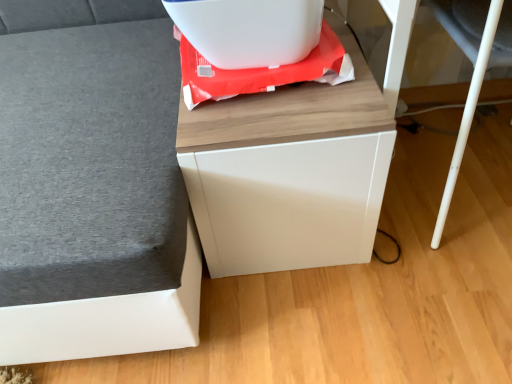
Question: Is the depth of white plastic container at upper center greater than that of white glossy cabinet at center, which appears as the second furniture when viewed from the left?

Choices:
 (A) no
 (B) yes

Answer: (B)

Question: Does white plastic container at upper center have a greater height compared to white glossy cabinet at center, arranged as the first furniture when viewed from the right?

Choices:
 (A) yes
 (B) no

Answer: (B)

Question: From the image's perspective, is white plastic container at upper center under white glossy cabinet at center, arranged as the first furniture when viewed from the right?

Choices:
 (A) yes
 (B) no

Answer: (B)

Question: From the image's perspective, would you say white plastic container at upper center is positioned over white glossy cabinet at center, which appears as the second furniture when viewed from the left?

Choices:
 (A) yes
 (B) no

Answer: (A)

Question: Is white plastic container at upper center oriented towards white glossy cabinet at center, arranged as the first furniture when viewed from the right?

Choices:
 (A) yes
 (B) no

Answer: (B)

Question: Based on their positions, is matte gray sofa at left, the second furniture positioned from the right, located to the left or right of white glossy cabinet at center, arranged as the first furniture when viewed from the right?

Choices:
 (A) left
 (B) right

Answer: (A)

Question: In terms of height, does matte gray sofa at left, the second furniture positioned from the right, look taller or shorter compared to white glossy cabinet at center, which appears as the second furniture when viewed from the left?

Choices:
 (A) short
 (B) tall

Answer: (B)

Question: From a real-world perspective, is matte gray sofa at left, the first furniture positioned from the left, above or below white glossy cabinet at center, which appears as the second furniture when viewed from the left?

Choices:
 (A) above
 (B) below

Answer: (A)

Question: Is point (130, 203) positioned closer to the camera than point (280, 142)?

Choices:
 (A) closer
 (B) farther

Answer: (A)

Question: Is white plastic swivel chair at lower right in front of or behind white glossy cabinet at center, arranged as the first furniture when viewed from the right, in the image?

Choices:
 (A) behind
 (B) front

Answer: (B)

Question: In terms of size, does white plastic swivel chair at lower right appear bigger or smaller than white glossy cabinet at center, which appears as the second furniture when viewed from the left?

Choices:
 (A) big
 (B) small

Answer: (A)

Question: Do you think white plastic swivel chair at lower right is within white glossy cabinet at center, arranged as the first furniture when viewed from the right, or outside of it?

Choices:
 (A) outside
 (B) inside

Answer: (A)

Question: Looking at their shapes, would you say white plastic swivel chair at lower right is wider or thinner than white glossy cabinet at center, arranged as the first furniture when viewed from the right?

Choices:
 (A) wide
 (B) thin

Answer: (B)

Question: From the image's perspective, is white plastic container at upper center positioned above or below matte gray sofa at left, the second furniture positioned from the right?

Choices:
 (A) above
 (B) below

Answer: (A)

Question: Based on their positions, is white plastic container at upper center located to the left or right of matte gray sofa at left, the first furniture positioned from the left?

Choices:
 (A) left
 (B) right

Answer: (B)